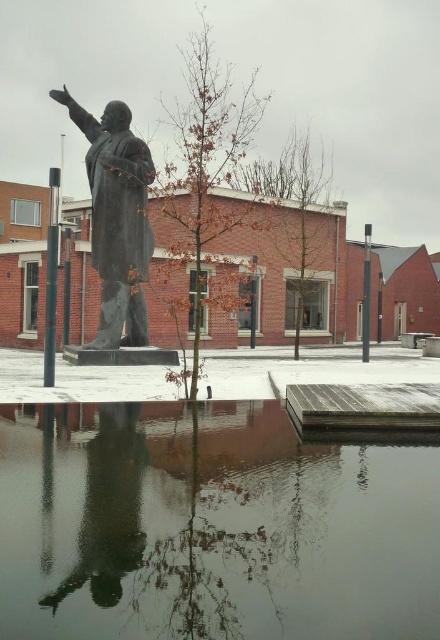
Based on the photo, you are a visitor at the park and want to take a photo of the bronze statue at center without the black metal pole at right appearing in the frame. How can you adjust your position to achieve this?

The bronze statue at center is positioned under the black metal pole at right, so if you move to the left side of the statue, the pole will be out of the frame.

You are standing in front of the statue and want to take a photo that includes both the statue and the red brick building. You notice two points marked on your camera screen at coordinates point (301, 552) and point (51, 316). Which point is closer to you when you aim the camera?

Point (301, 552) is closer to the camera than point (51, 316).